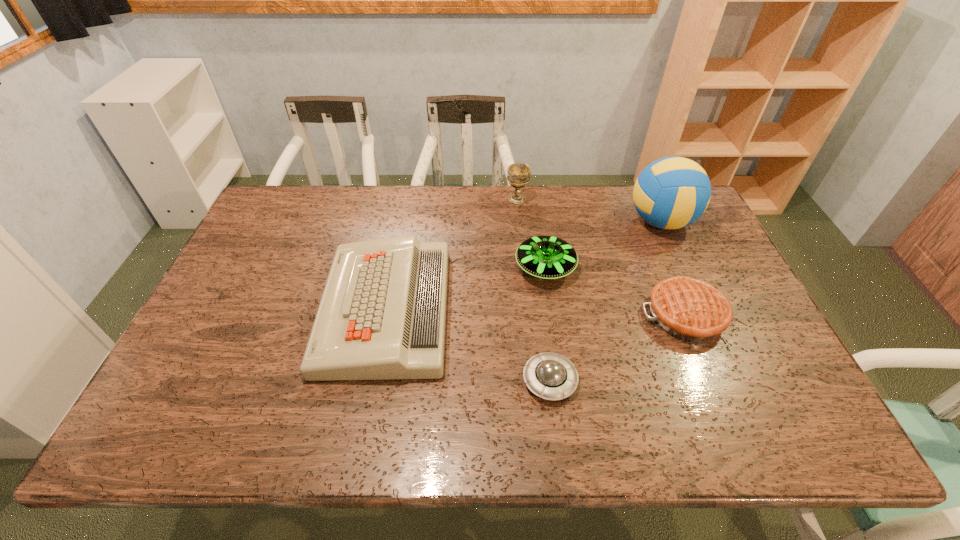
The height and width of the screenshot is (540, 960). I want to click on the tallest object, so click(x=670, y=193).

At what (x,y) coordinates should I click in order to perform the action: click on chalice. Please return your answer as a coordinate pair (x, y). Image resolution: width=960 pixels, height=540 pixels. Looking at the image, I should click on (518, 174).

Identify the location of the farther saucer. The height and width of the screenshot is (540, 960). pos(546,257).

You are a GUI agent. You are given a task and a screenshot of the screen. Output one action in this format:
    pyautogui.click(x=<x>, y=<y>)
    Task: Click on the pie
    The image size is (960, 540).
    Given the screenshot: What is the action you would take?
    pyautogui.click(x=689, y=309)

I want to click on computer keyboard, so click(382, 315).

Locate an element on the screen. This screenshot has width=960, height=540. the nearer saucer is located at coordinates (551, 376).

Locate an element on the screen. the shorter saucer is located at coordinates (551, 376).

Where is `vacant region located 0.240m on the front of the volleyball`? vacant region located 0.240m on the front of the volleyball is located at coordinates (697, 302).

Where is `vacant space located 0.230m on the front of the chalice`? The width and height of the screenshot is (960, 540). vacant space located 0.230m on the front of the chalice is located at coordinates (522, 251).

The height and width of the screenshot is (540, 960). I want to click on free space located 0.220m on the left of the farther saucer, so click(441, 267).